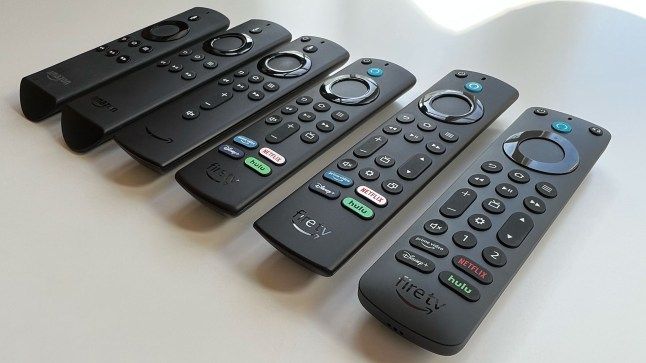
At what (x,y) coordinates should I click in order to perform the action: click on remote controls. Please return your answer as a coordinate pair (x, y). This screenshot has width=646, height=363. Looking at the image, I should click on (87, 64), (146, 89), (176, 128), (213, 176), (313, 215), (407, 306).